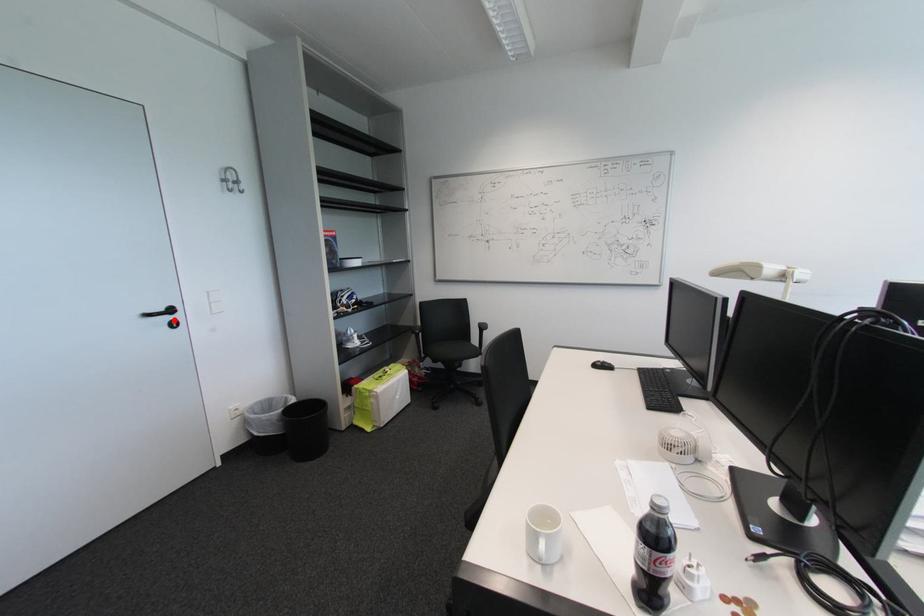
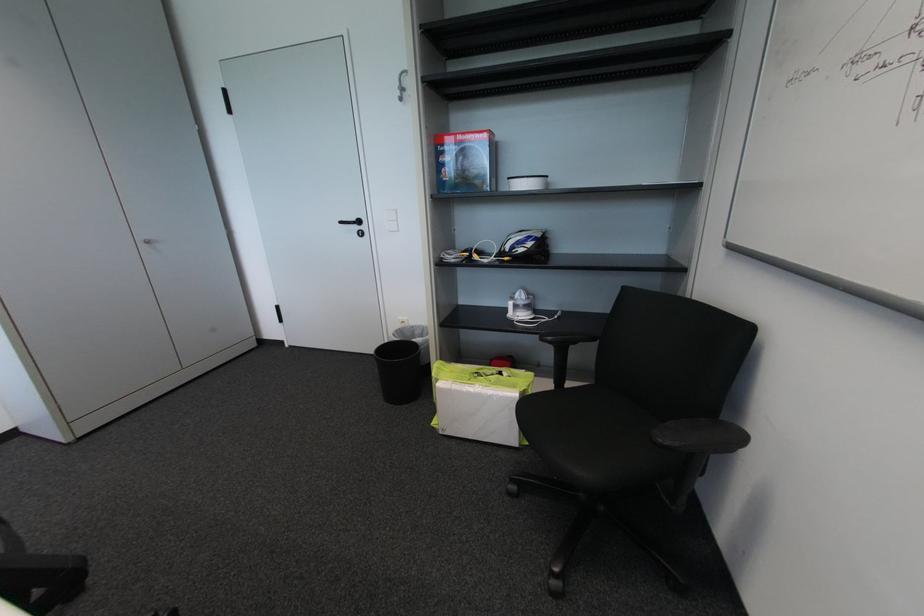
In the second image, find the point that corresponds to the highlighted location in the first image.

(362, 229)